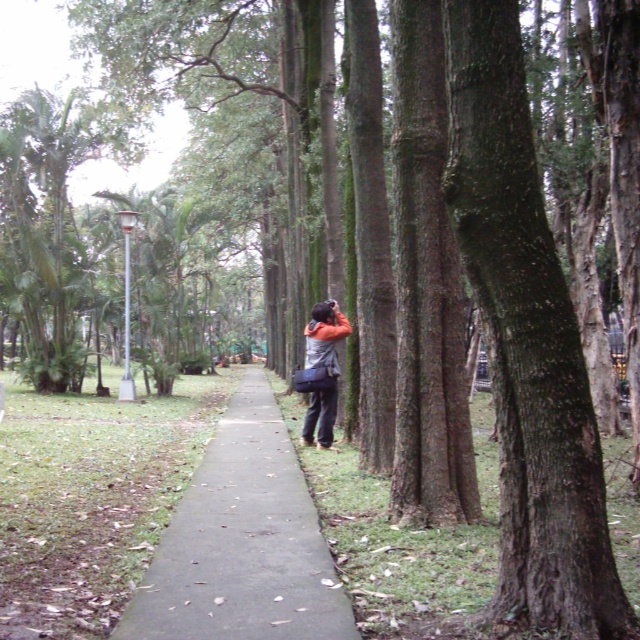
Question: Is gray concrete sidewalk at center to the right of orange fabric jacket at center from the viewer's perspective?

Choices:
 (A) no
 (B) yes

Answer: (A)

Question: Does gray concrete sidewalk at center have a lesser width compared to orange fabric jacket at center?

Choices:
 (A) no
 (B) yes

Answer: (A)

Question: Does gray concrete sidewalk at center appear over orange fabric jacket at center?

Choices:
 (A) yes
 (B) no

Answer: (B)